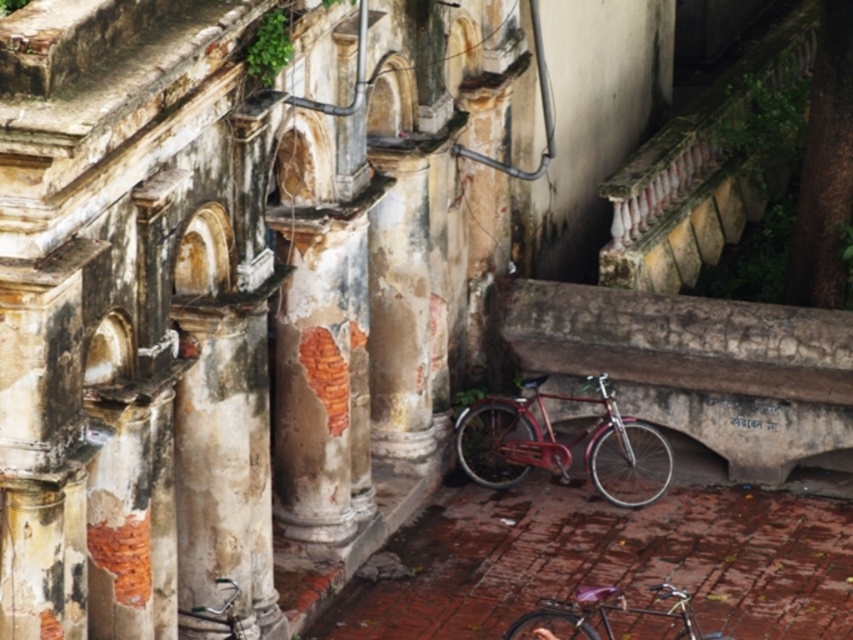
Between point (584, 461) and point (590, 589), which one is positioned in front?

Positioned in front is point (590, 589).

The image size is (853, 640). What are the coordinates of `shiny metallic bicycle at lower center` in the screenshot? It's located at (563, 444).

Locate an element on the screen. shiny metallic bicycle at lower center is located at coordinates (563, 444).